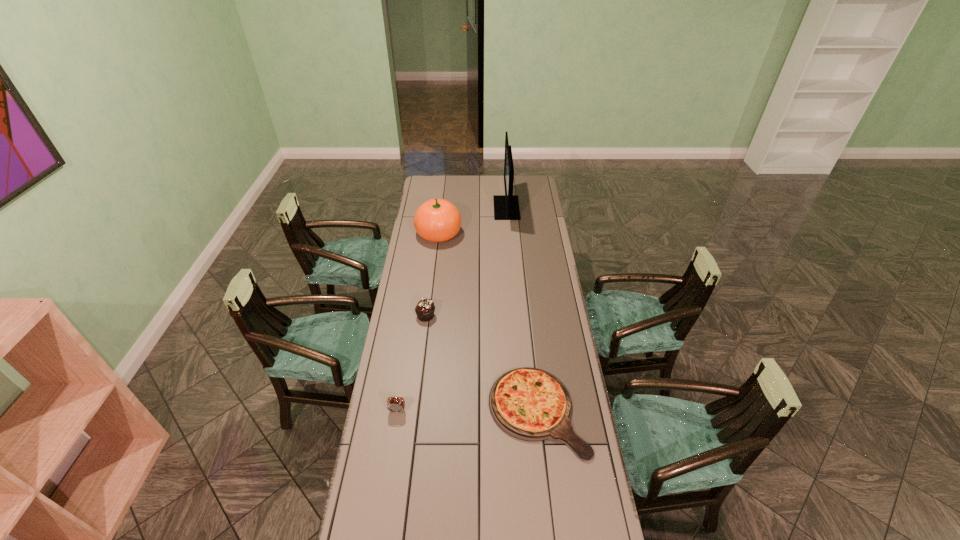
Where is `free spot located on the face of the alarm clock`? The width and height of the screenshot is (960, 540). free spot located on the face of the alarm clock is located at coordinates (394, 437).

Locate an element on the screen. vacant region located on the back of the shortest object is located at coordinates (529, 336).

Identify the location of object that is at the far edge. The height and width of the screenshot is (540, 960). (506, 207).

Locate an element on the screen. pumpkin present at the left edge is located at coordinates (437, 220).

The image size is (960, 540). What are the coordinates of `cupcake that is at the left edge` in the screenshot? It's located at (425, 308).

The image size is (960, 540). In order to click on alarm clock positioned at the left edge in this screenshot , I will do `click(397, 404)`.

The height and width of the screenshot is (540, 960). Find the location of `monitor positioned at the right edge`. monitor positioned at the right edge is located at coordinates (506, 207).

The height and width of the screenshot is (540, 960). Find the location of `pizza that is at the right edge`. pizza that is at the right edge is located at coordinates (530, 404).

This screenshot has width=960, height=540. Identify the location of object that is at the far right corner. (506, 207).

At what (x,y) coordinates should I click in order to perform the action: click on vacant space at the far edge of the desktop. Please return your answer as a coordinate pair (x, y). This screenshot has height=540, width=960. Looking at the image, I should click on (483, 188).